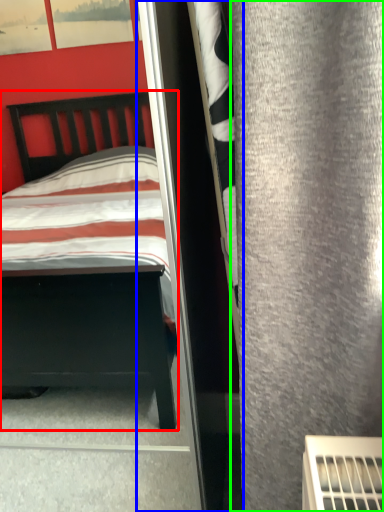
Question: Based on their relative distances, which object is nearer to bed (highlighted by a red box)? Choose from screen door (highlighted by a blue box) and curtain (highlighted by a green box).

Choices:
 (A) screen door
 (B) curtain

Answer: (A)